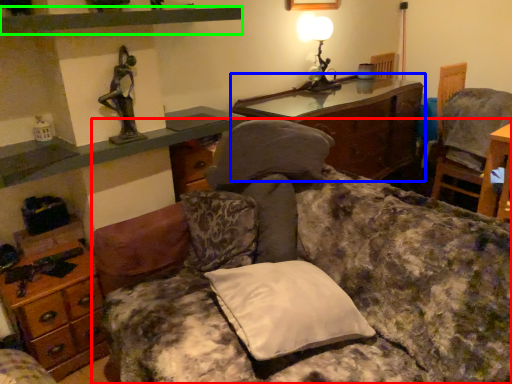
Question: Considering the real-world distances, which object is farthest from studio couch (highlighted by a red box)? nightstand (highlighted by a blue box) or shelf (highlighted by a green box)?

Choices:
 (A) nightstand
 (B) shelf

Answer: (A)